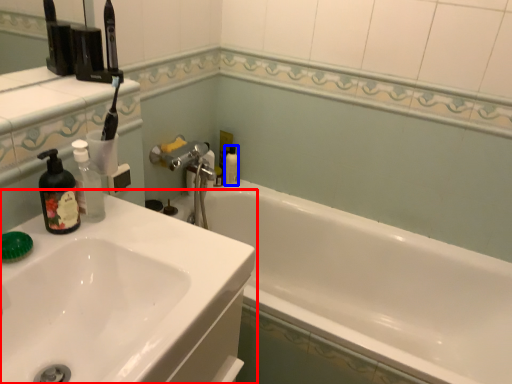
Question: Which point is further to the camera, sink (highlighted by a red box) or mouthwash (highlighted by a blue box)?

Choices:
 (A) sink
 (B) mouthwash

Answer: (B)